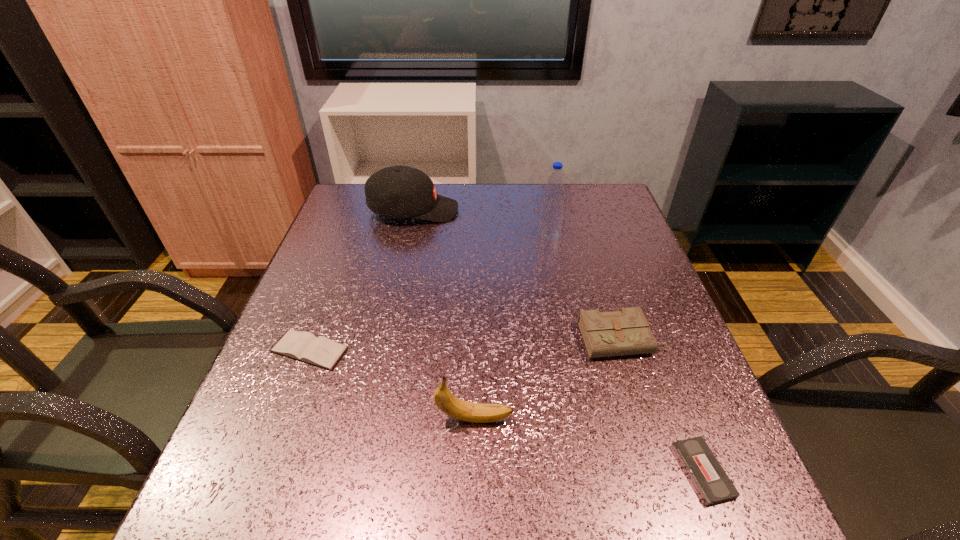
Where is `the fifth nearest object`? The width and height of the screenshot is (960, 540). the fifth nearest object is located at coordinates (552, 209).

The height and width of the screenshot is (540, 960). What are the coordinates of `water bottle` in the screenshot? It's located at (552, 209).

In order to click on the farthest object in this screenshot , I will do coord(400,191).

Identify the location of banana. The height and width of the screenshot is (540, 960). (449, 404).

At what (x,y) coordinates should I click in order to perform the action: click on the taller diary. Please return your answer as a coordinate pair (x, y). Looking at the image, I should click on (626, 332).

I want to click on the third shortest object, so click(x=626, y=332).

Identify the location of the left diary. The image size is (960, 540). (305, 347).

The width and height of the screenshot is (960, 540). Find the location of `the second shortest object`. the second shortest object is located at coordinates (305, 347).

This screenshot has height=540, width=960. What are the coordinates of `videotape` in the screenshot? It's located at (713, 485).

This screenshot has height=540, width=960. Find the location of `the nearest object`. the nearest object is located at coordinates (713, 485).